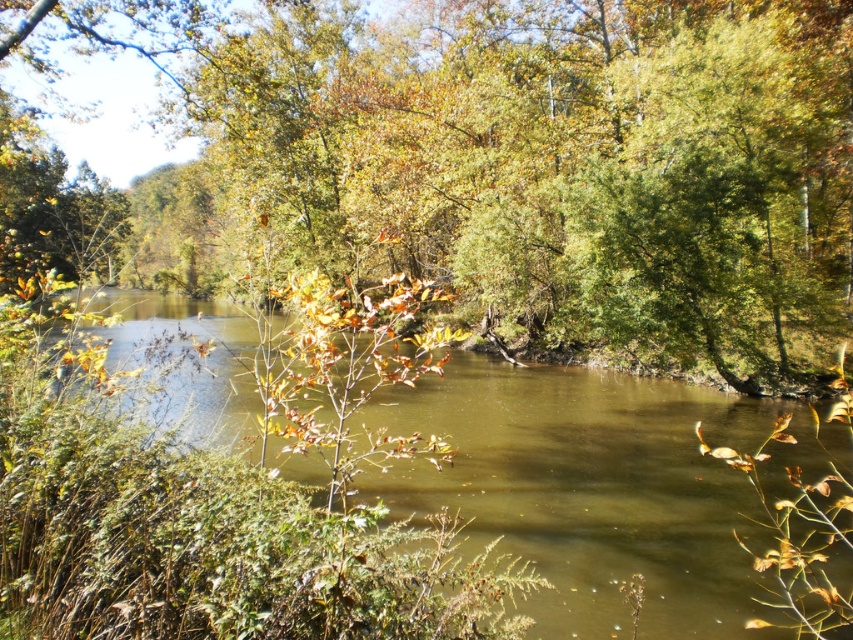
You are standing on the riverbank and see the green leafy tree at center and the brown murky water at center. Which object is bigger in size?

The green leafy tree at center has a larger size compared to the brown murky water at center.

In the scene shown: You are a hiker who wants to cross the river using a narrow wooden bridge that is 15 meters long. The bridge is located between the green leafy tree at center and the brown murky water at center. Can you safely cross the river using this bridge?

The distance between the green leafy tree at center and the brown murky water at center is 17.66 meters. The bridge is only 15 meters long, so it would not be long enough to span the gap. Therefore, you cannot safely cross the river using this bridge.

You are standing on the riverbank and want to cross to the opposite side. There is a green leafy tree at center and a brown murky water at center. Which object should you avoid stepping on to cross safely?

You should avoid stepping on the brown murky water at center because it is not solid ground. The green leafy tree at center is a solid structure, but it is not meant for walking on. To cross safely, you should find a path around the brown murky water at center.